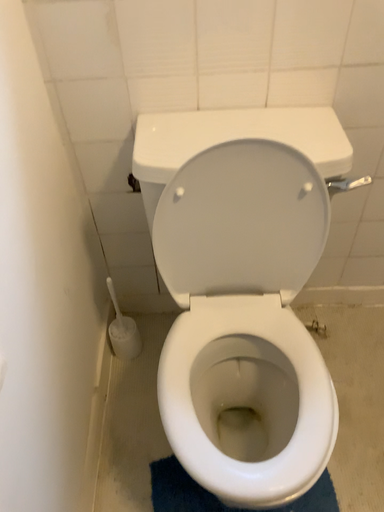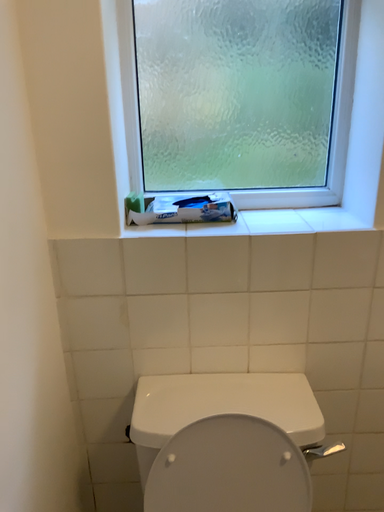
Question: How did the camera likely rotate when shooting the video?

Choices:
 (A) rotated upward
 (B) rotated downward

Answer: (A)